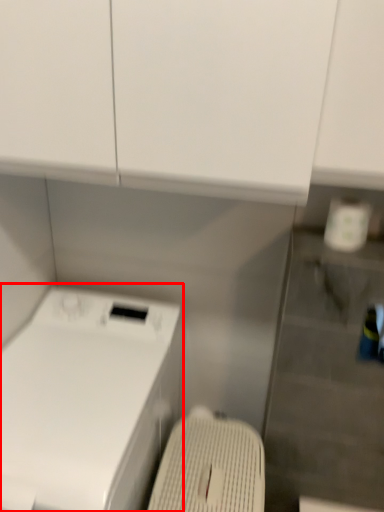
Question: From the image's perspective, where is home appliance (annotated by the red box) located relative to washing machine?

Choices:
 (A) above
 (B) below

Answer: (A)